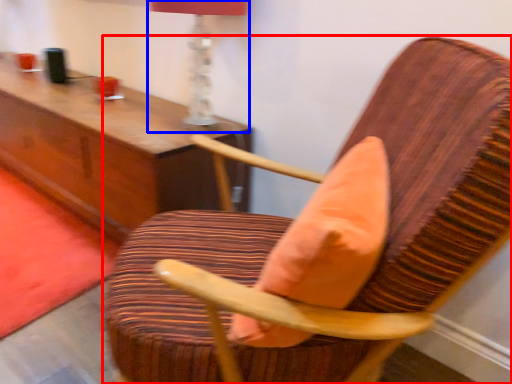
Question: Among these objects, which one is nearest to the camera, chair (highlighted by a red box) or table lamp (highlighted by a blue box)?

Choices:
 (A) chair
 (B) table lamp

Answer: (A)